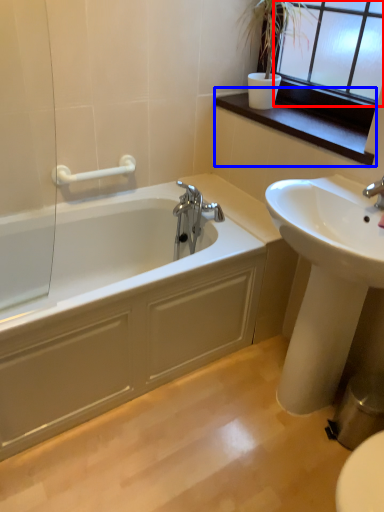
Question: Which point is further to the camera, window frame (highlighted by a red box) or window sill (highlighted by a blue box)?

Choices:
 (A) window frame
 (B) window sill

Answer: (B)